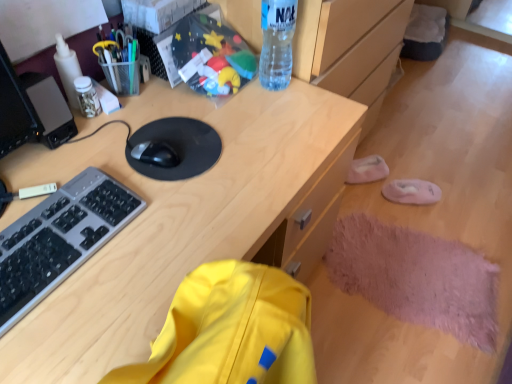
In order to click on vacant area in front of black matte mouse at center in this screenshot , I will do `click(150, 208)`.